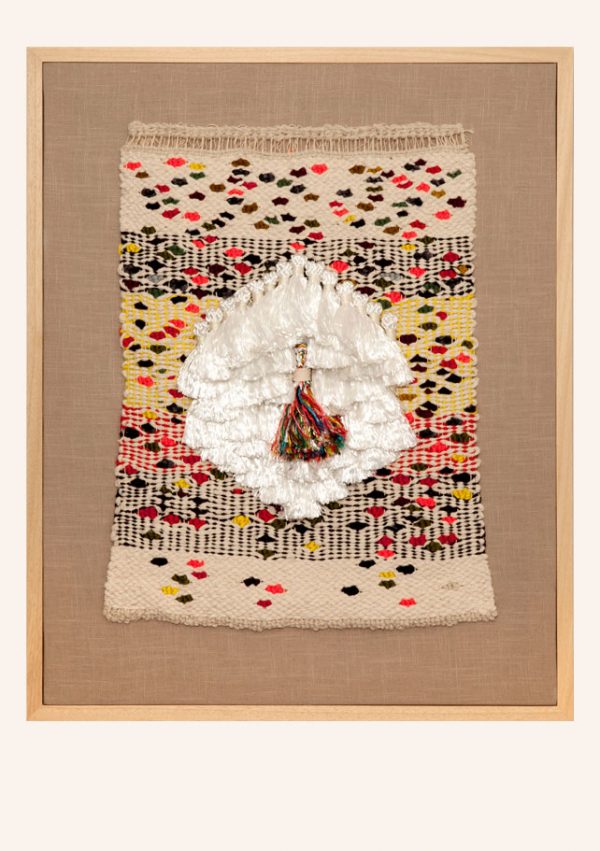
Find the location of a particular element. board is located at coordinates (529, 243).